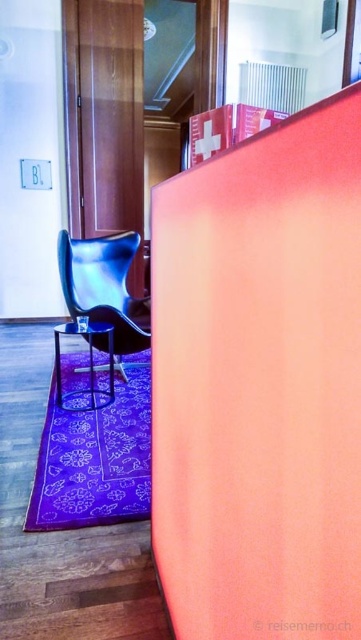
Is shiny blue leather armchair at lower left thinner than metallic stool at lower left?

No, shiny blue leather armchair at lower left is not thinner than metallic stool at lower left.

The image size is (361, 640). What are the coordinates of `shiny blue leather armchair at lower left` in the screenshot? It's located at (105, 289).